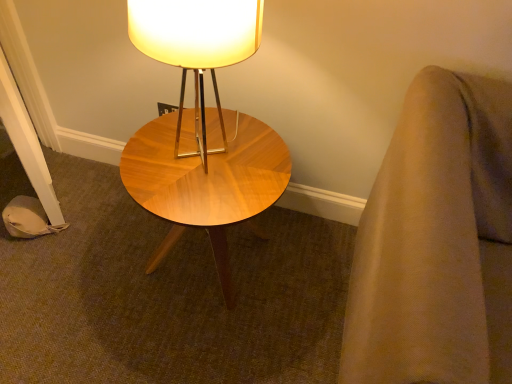
Locate an element on the screen. Image resolution: width=512 pixels, height=384 pixels. free region under woodenwoodencoffee table at center (from a real-world perspective) is located at coordinates (215, 260).